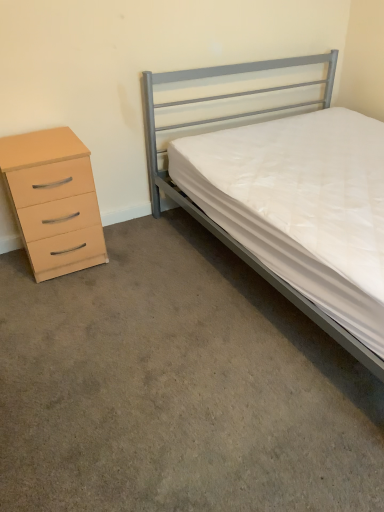
Question: Based on their sizes in the image, would you say carpet at lower left is bigger or smaller than beige matte chest of drawers at left?

Choices:
 (A) small
 (B) big

Answer: (A)

Question: In the image, is carpet at lower left on the left side or the right side of beige matte chest of drawers at left?

Choices:
 (A) right
 (B) left

Answer: (A)

Question: Which object is positioned farthest from the metallic gray bed at right?

Choices:
 (A) carpet at lower left
 (B) beige matte chest of drawers at left

Answer: (A)

Question: Estimate the real-world distances between objects in this image. Which object is farther from the metallic gray bed at right?

Choices:
 (A) beige matte chest of drawers at left
 (B) carpet at lower left

Answer: (B)